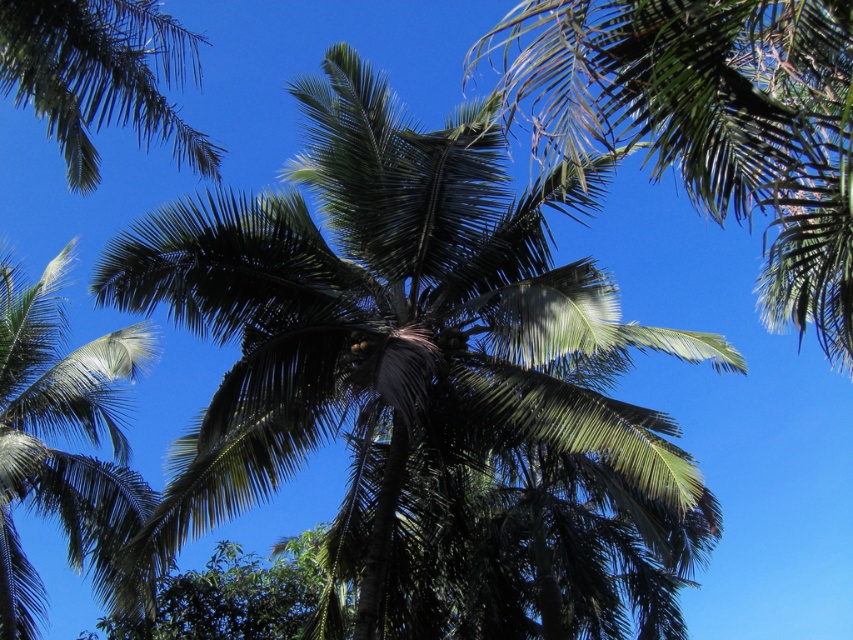
Can you confirm if green leafy coconut tree at center is wider than green leafy palm at center?

Yes.

Can you confirm if green leafy coconut tree at center is bigger than green leafy palm at center?

Yes, green leafy coconut tree at center is bigger than green leafy palm at center.

You are a GUI agent. You are given a task and a screenshot of the screen. Output one action in this format:
    pyautogui.click(x=<x>, y=<y>)
    Task: Click on the green leafy coconut tree at center
    Image resolution: width=853 pixels, height=640 pixels.
    Given the screenshot: What is the action you would take?
    pyautogui.click(x=426, y=380)

Who is taller, green leafy palm tree at left or green leafy palm at upper left?

With more height is green leafy palm tree at left.

Can you confirm if green leafy palm tree at left is smaller than green leafy palm at upper left?

No.

This screenshot has width=853, height=640. What are the coordinates of `green leafy palm tree at left` in the screenshot? It's located at (62, 435).

Between point (659, 488) and point (56, 291), which one is positioned in front?

Point (659, 488) is more forward.

Is green leafy coconut tree at center positioned at the back of green leafy palm tree at left?

No, green leafy coconut tree at center is in front of green leafy palm tree at left.

Does point (514, 218) come behind point (32, 621)?

That is False.

Where is `green leafy coconut tree at center`? Image resolution: width=853 pixels, height=640 pixels. green leafy coconut tree at center is located at coordinates (426, 380).